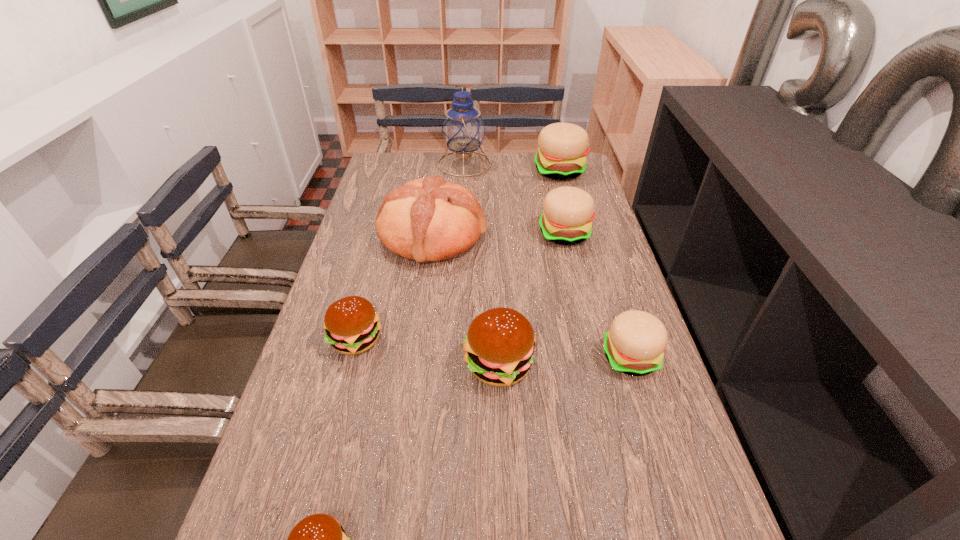
Find the location of `the tallest object`. the tallest object is located at coordinates (463, 129).

What are the coordinates of `lantern` in the screenshot? It's located at (463, 129).

Image resolution: width=960 pixels, height=540 pixels. In order to click on the biggest beige hamburger in this screenshot , I will do `click(562, 147)`.

You are a GUI agent. You are given a task and a screenshot of the screen. Output one action in this format:
    pyautogui.click(x=<x>, y=<y>)
    Task: Click on the farthest beige hamburger
    The width and height of the screenshot is (960, 540).
    Given the screenshot: What is the action you would take?
    pyautogui.click(x=562, y=147)

Find the location of a particular element. The width and height of the screenshot is (960, 540). bread is located at coordinates (427, 219).

Identify the location of the third hamburger from left to right. The width and height of the screenshot is (960, 540). (500, 342).

You are a GUI agent. You are given a task and a screenshot of the screen. Output one action in this format:
    pyautogui.click(x=<x>, y=<y>)
    Task: Click on the biggest brown hamburger
    This screenshot has width=960, height=540.
    Given the screenshot: What is the action you would take?
    pyautogui.click(x=500, y=342)

This screenshot has height=540, width=960. What are the coordinates of `the second nearest beige hamburger` in the screenshot? It's located at (567, 216).

You are a GUI agent. You are given a task and a screenshot of the screen. Output one action in this format:
    pyautogui.click(x=<x>, y=<y>)
    Task: Click on the second smallest beige hamburger
    The height and width of the screenshot is (540, 960).
    Given the screenshot: What is the action you would take?
    pyautogui.click(x=567, y=216)

Identify the location of the second smallest brown hamburger. The image size is (960, 540). (351, 324).